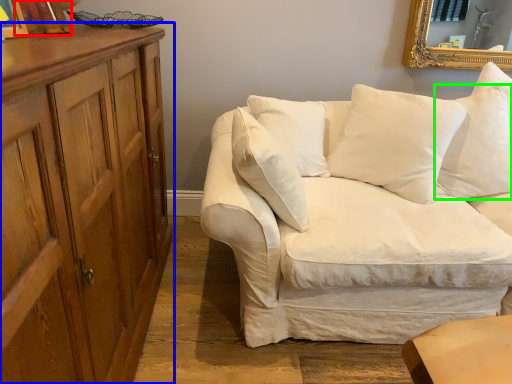
Question: Estimate the real-world distances between objects in this image. Which object is farther from picture frame (highlighted by a red box), cabinetry (highlighted by a blue box) or pillow (highlighted by a green box)?

Choices:
 (A) cabinetry
 (B) pillow

Answer: (B)